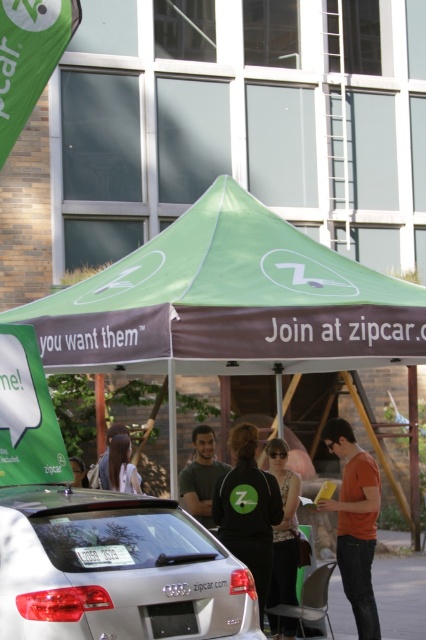
Is point (354, 468) positioned behind point (106, 456)?

No, it is not.

Between orange cotton t-shirt at center and dark brown hair at center, which one is positioned lower?

orange cotton t-shirt at center

Is point (374, 538) closer to viewer compared to point (101, 481)?

Yes, it is.

This screenshot has width=426, height=640. What are the coordinates of `orange cotton t-shirt at center` in the screenshot? It's located at (354, 524).

The width and height of the screenshot is (426, 640). Identify the location of matte green t-shirt at center. (201, 476).

What are the coordinates of `matte green t-shirt at center` in the screenshot? It's located at (201, 476).

The width and height of the screenshot is (426, 640). I want to click on matte green t-shirt at center, so click(x=201, y=476).

Is satin silver car at center positioned before matte black jacket at center?

Yes, it is.

Consider the image. Is satin silver car at center smaller than matte black jacket at center?

Incorrect, satin silver car at center is not smaller in size than matte black jacket at center.

Measure the distance between point (189, 596) and camera.

A distance of 18.65 feet exists between point (189, 596) and camera.

The image size is (426, 640). In order to click on satin silver car at center in this screenshot , I will do `click(115, 570)`.